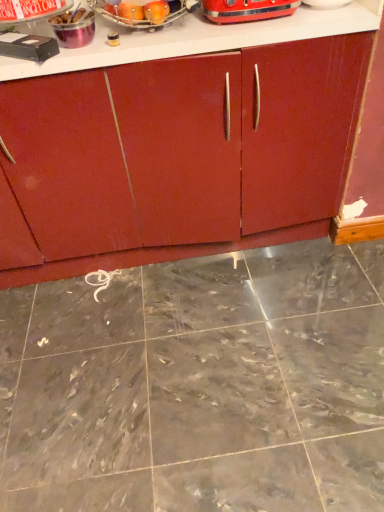
Image resolution: width=384 pixels, height=512 pixels. Identify the location of free spot above gray marble floor at center (from a real-world perspective). (200, 355).